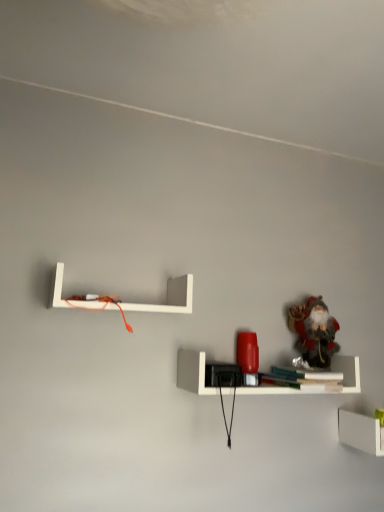
Question: Does white matte shelf at lower right, which appears as the 1th shelf when viewed from the right, come in front of matte red lamp at center, acting as the 2th shelf starting from the top?

Choices:
 (A) yes
 (B) no

Answer: (B)

Question: Is white matte shelf at lower right, which is the third shelf from top to bottom, outside of matte red lamp at center, acting as the 2th shelf starting from the top?

Choices:
 (A) yes
 (B) no

Answer: (A)

Question: Can you confirm if white matte shelf at lower right, which is the third shelf from top to bottom, is wider than matte red lamp at center, which ranks as the second shelf in right-to-left order?

Choices:
 (A) yes
 (B) no

Answer: (B)

Question: Is white matte shelf at lower right, which appears as the 1th shelf when viewed from the right, shorter than matte red lamp at center, which ranks as the second shelf in right-to-left order?

Choices:
 (A) no
 (B) yes

Answer: (B)

Question: Considering the relative sizes of white matte shelf at lower right, which is the third shelf from top to bottom, and matte red lamp at center, the 2th shelf in the bottom-to-top sequence, in the image provided, is white matte shelf at lower right, which is the third shelf from top to bottom, smaller than matte red lamp at center, the 2th shelf in the bottom-to-top sequence,?

Choices:
 (A) yes
 (B) no

Answer: (A)

Question: Considering the relative positions of white matte shelf at lower right, which appears as the 1th shelf when viewed from the right, and matte red lamp at center, which ranks as the second shelf in right-to-left order, in the image provided, is white matte shelf at lower right, which appears as the 1th shelf when viewed from the right, to the left of matte red lamp at center, which ranks as the second shelf in right-to-left order, from the viewer's perspective?

Choices:
 (A) no
 (B) yes

Answer: (A)

Question: Does white matte shelf at upper left, marked as the first shelf in a left-to-right arrangement, appear on the left side of white matte line at upper center?

Choices:
 (A) yes
 (B) no

Answer: (A)

Question: From a real-world perspective, is white matte shelf at upper left, placed as the 3th shelf when sorted from right to left, on white matte line at upper center?

Choices:
 (A) no
 (B) yes

Answer: (A)

Question: Considering the relative sizes of white matte shelf at upper left, marked as the first shelf in a left-to-right arrangement, and white matte line at upper center in the image provided, is white matte shelf at upper left, marked as the first shelf in a left-to-right arrangement, wider than white matte line at upper center?

Choices:
 (A) no
 (B) yes

Answer: (A)

Question: Is white matte shelf at upper left, which appears as the first shelf when viewed from the top, outside white matte line at upper center?

Choices:
 (A) yes
 (B) no

Answer: (A)

Question: From the image's perspective, is white matte shelf at upper left, marked as the first shelf in a left-to-right arrangement, located beneath white matte line at upper center?

Choices:
 (A) yes
 (B) no

Answer: (A)

Question: Is white matte shelf at upper left, which appears as the first shelf when viewed from the top, positioned in front of white matte line at upper center?

Choices:
 (A) no
 (B) yes

Answer: (A)

Question: Is white matte shelf at lower right, marked as the first shelf in a bottom-to-top arrangement, wider than frosted glass santa at upper right?

Choices:
 (A) yes
 (B) no

Answer: (A)